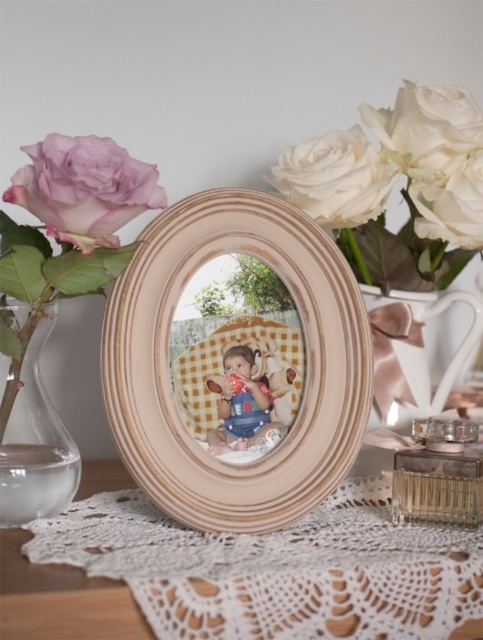
You are organizing a display and need to know the relative widths of the objects. Which object is wider, the wooden frame at center or the matte blue jumpsuit at center?

The wooden frame at center is wider than the matte blue jumpsuit at center according to the description.

You are a delivery person trying to place a small package between the transparent glass vase at left and the clear glass perfume at center. The package is 20 centimeters wide. Can it fit in the space between them?

The distance between the transparent glass vase at left and the clear glass perfume at center is 25.23 centimeters. Since the package is 20 centimeters wide, it can fit in the space between them.